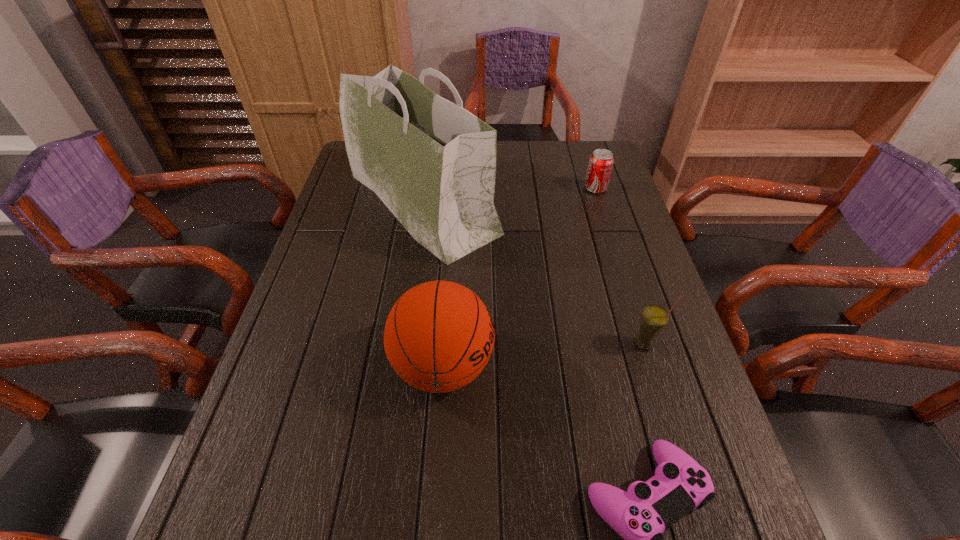
I want to click on grocery bag, so click(x=433, y=163).

Locate an element on the screen. Image resolution: width=960 pixels, height=540 pixels. the fourth shortest object is located at coordinates (439, 335).

Where is `the third shortest object`? The height and width of the screenshot is (540, 960). the third shortest object is located at coordinates (654, 318).

I want to click on soda, so click(600, 165).

Where is `free space located on the front of the tallest object`? The height and width of the screenshot is (540, 960). free space located on the front of the tallest object is located at coordinates (408, 308).

Identify the location of free space located on the side with logo of the fourth shortest object. The height and width of the screenshot is (540, 960). (675, 366).

You are a GUI agent. You are given a task and a screenshot of the screen. Output one action in this format:
    pyautogui.click(x=<x>, y=<y>)
    Task: Click on the free space located 0.070m on the left of the straw for drinking
    The image size is (960, 540).
    Given the screenshot: What is the action you would take?
    pyautogui.click(x=600, y=345)

This screenshot has height=540, width=960. In order to click on free space located on the front of the fourth tallest object in this screenshot , I will do `click(623, 276)`.

Identify the location of object at the far edge. (433, 163).

You are a GUI agent. You are given a task and a screenshot of the screen. Output one action in this format:
    pyautogui.click(x=<x>, y=<y>)
    Task: Click on the object at the left edge
    The width and height of the screenshot is (960, 540).
    Given the screenshot: What is the action you would take?
    pyautogui.click(x=433, y=163)